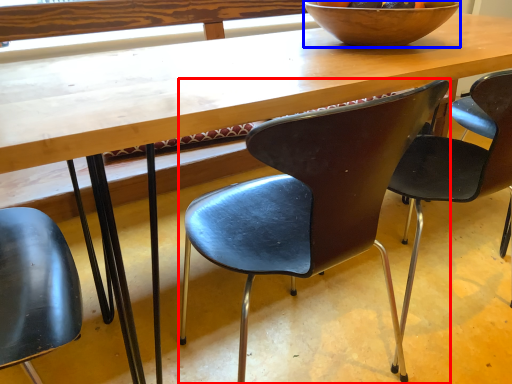
Question: Which of the following is the closest to the observer, chair (highlighted by a red box) or bowl (highlighted by a blue box)?

Choices:
 (A) chair
 (B) bowl

Answer: (A)